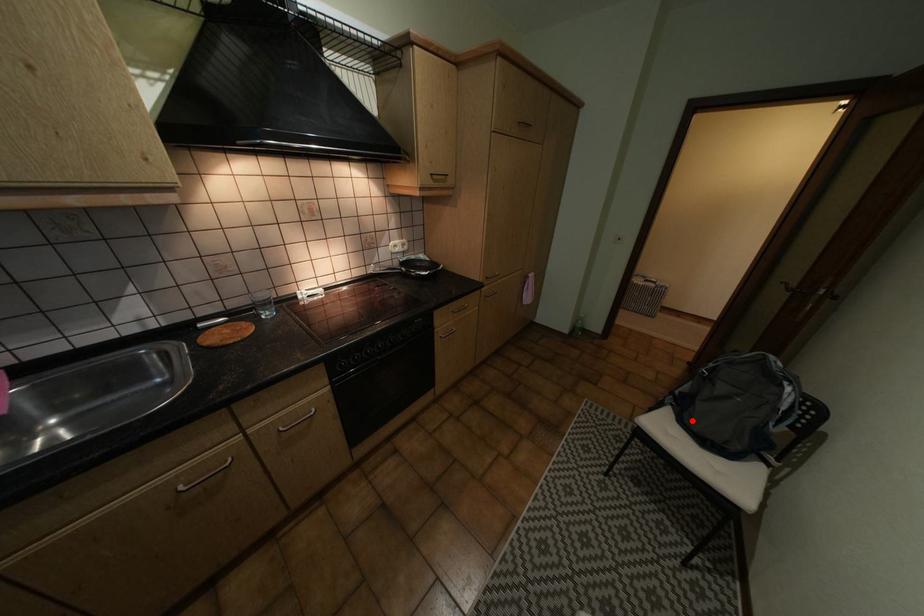
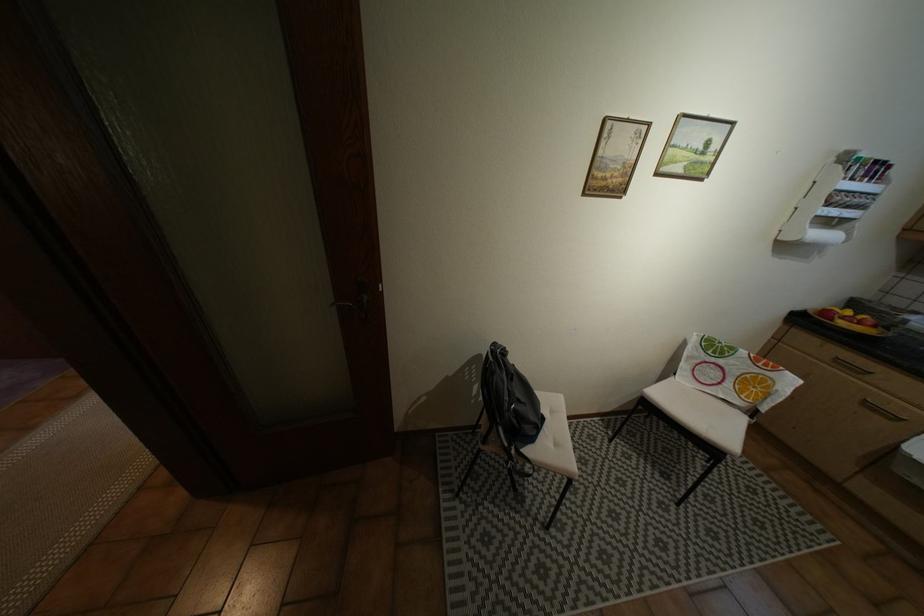
Question: I am providing you with two images of the same scene from different viewpoints. In image1, a red point is highlighted. Considering the same 3D point in image2, which of the following is correct?

Choices:
 (A) It is closer
 (B) It is farther

Answer: (B)